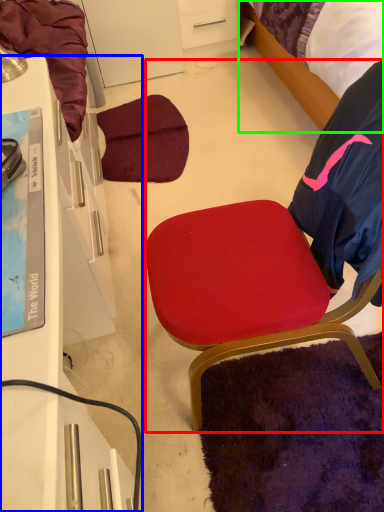
Question: Considering the real-world distances, which object is farthest from chair (highlighted by a red box)? desk (highlighted by a blue box) or bed (highlighted by a green box)?

Choices:
 (A) desk
 (B) bed

Answer: (B)